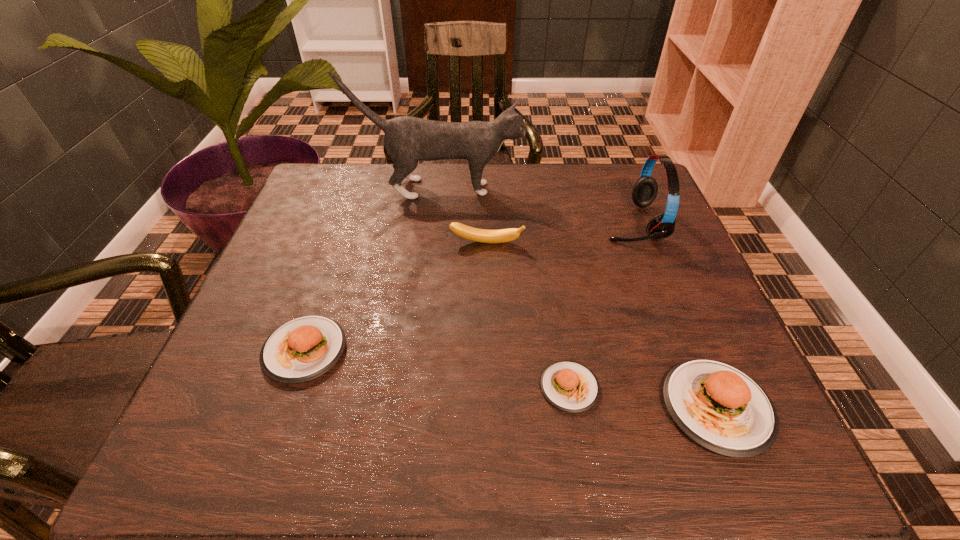
The width and height of the screenshot is (960, 540). Identify the location of vacant region located 0.140m on the left of the rightmost food. (579, 408).

At what (x,y) coordinates should I click in order to perform the action: click on vacant space located 0.060m at the face of the cat. Please return your answer as a coordinate pair (x, y). The width and height of the screenshot is (960, 540). Looking at the image, I should click on (545, 188).

At what (x,y) coordinates should I click in order to perform the action: click on vacant space situated 0.120m with the microphone attached to the side of the headset. Please return your answer as a coordinate pair (x, y). Image resolution: width=960 pixels, height=540 pixels. Looking at the image, I should click on (554, 222).

At what (x,y) coordinates should I click in order to perform the action: click on free point located 0.140m with the microphone attached to the side of the headset. Please return your answer as a coordinate pair (x, y). This screenshot has height=540, width=960. Looking at the image, I should click on (545, 222).

Where is `vacant region located 0.200m with the microphone attached to the side of the headset`? The height and width of the screenshot is (540, 960). vacant region located 0.200m with the microphone attached to the side of the headset is located at coordinates (521, 222).

You are a GUI agent. You are given a task and a screenshot of the screen. Output one action in this format:
    pyautogui.click(x=<x>, y=<y>)
    Task: Click on the vacant point located at the stem of the banana
    
    Given the screenshot: What is the action you would take?
    pyautogui.click(x=489, y=378)

The image size is (960, 540). I want to click on cat situated at the far edge, so click(407, 140).

At what (x,y) coordinates should I click in order to perform the action: click on headset that is at the far edge. Please return your answer as a coordinate pair (x, y). This screenshot has height=540, width=960. Looking at the image, I should click on (644, 192).

Where is `food at the left edge`? This screenshot has width=960, height=540. food at the left edge is located at coordinates (302, 349).

The width and height of the screenshot is (960, 540). Identify the location of cat present at the left edge. (407, 140).